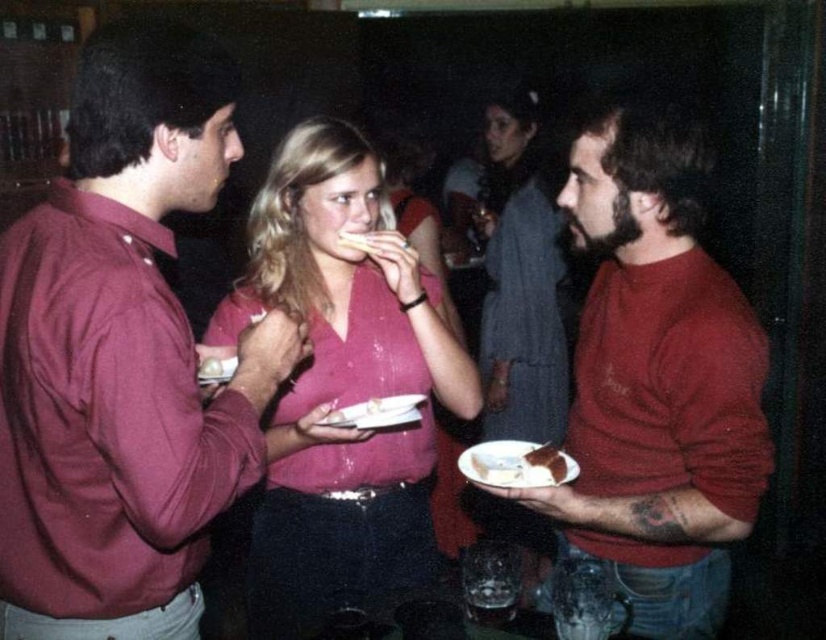
You are at the party and want to grab a drink from the bar located at the far end of the room. There is a white paper plate at lower right in your path. Can you step over it without moving the plate?

The white paper plate at lower right is located at point (511, 465), so yes, you can step over it without moving the plate since it is stationary and you can navigate around it in your path to the bar.